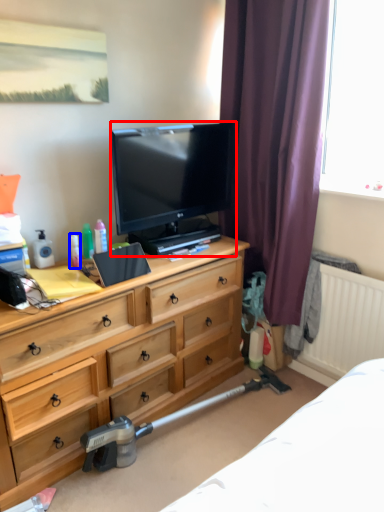
Question: Which of the following is the closest to the observer, television (highlighted by a red box) or toiletry (highlighted by a blue box)?

Choices:
 (A) television
 (B) toiletry

Answer: (A)